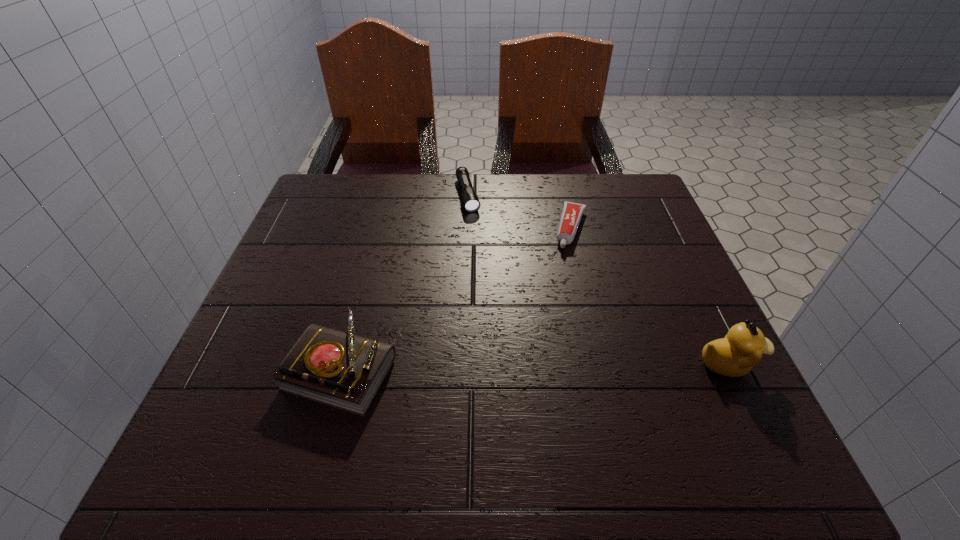
Locate an element on the screen. The width and height of the screenshot is (960, 540). vacant space on the desktop that is between the third shortest object and the duckling and is positioned at the nozzle of the toothpaste is located at coordinates (533, 366).

Where is `vacant spot on the desktop that is between the diary and the tallest object and is positioned at the lens end of the second object from left to right`? vacant spot on the desktop that is between the diary and the tallest object and is positioned at the lens end of the second object from left to right is located at coordinates (520, 366).